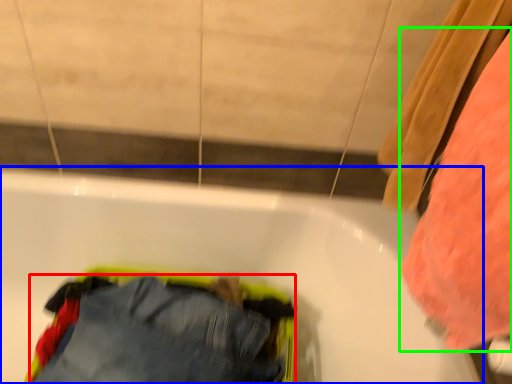
Question: Which object is the farthest from trousers (highlighted by a red box)? Choose among these: bathtub (highlighted by a blue box) or clothing (highlighted by a green box).

Choices:
 (A) bathtub
 (B) clothing

Answer: (B)